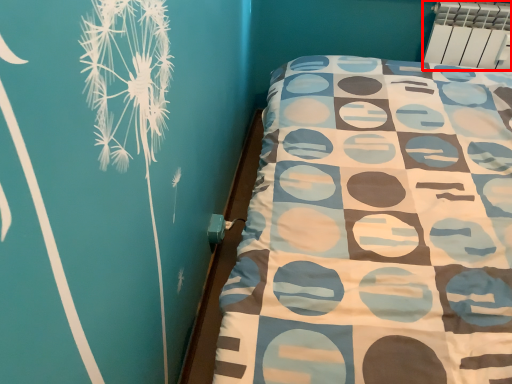
Question: From the image's perspective, where is radiator (annotated by the red box) located relative to bed frame?

Choices:
 (A) above
 (B) below

Answer: (A)